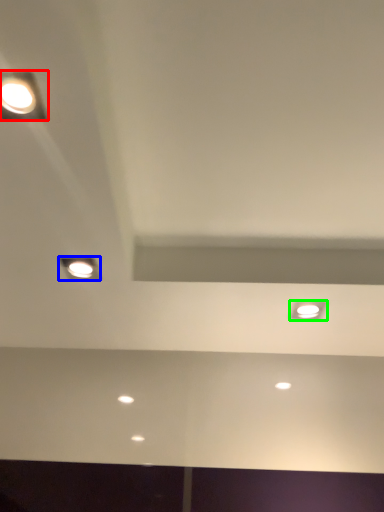
Question: Estimate the real-world distances between objects in this image. Which object is farther from lamp (highlighted by a red box), lamp (highlighted by a blue box) or dot (highlighted by a green box)?

Choices:
 (A) lamp
 (B) dot

Answer: (B)